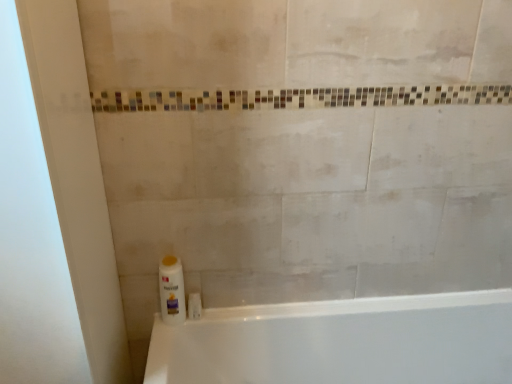
Question: From the image's perspective, would you say white glossy bathtub at lower left is shown under white glossy screen door at left?

Choices:
 (A) no
 (B) yes

Answer: (B)

Question: Considering the relative sizes of white glossy bathtub at lower left and white glossy screen door at left in the image provided, is white glossy bathtub at lower left taller than white glossy screen door at left?

Choices:
 (A) no
 (B) yes

Answer: (A)

Question: Is white glossy bathtub at lower left in contact with white glossy screen door at left?

Choices:
 (A) no
 (B) yes

Answer: (A)

Question: Can you confirm if white glossy bathtub at lower left is smaller than white glossy screen door at left?

Choices:
 (A) no
 (B) yes

Answer: (A)

Question: From a real-world perspective, does white glossy bathtub at lower left stand above white glossy screen door at left?

Choices:
 (A) no
 (B) yes

Answer: (A)

Question: Considering the relative positions of white glossy screen door at left and white glossy bathtub at lower left in the image provided, is white glossy screen door at left to the left or to the right of white glossy bathtub at lower left?

Choices:
 (A) right
 (B) left

Answer: (B)

Question: From the image's perspective, relative to white glossy bathtub at lower left, is white glossy screen door at left above or below?

Choices:
 (A) above
 (B) below

Answer: (A)

Question: Based on their sizes in the image, would you say white glossy screen door at left is bigger or smaller than white glossy bathtub at lower left?

Choices:
 (A) small
 (B) big

Answer: (A)

Question: Considering their positions, is white glossy screen door at left located in front of or behind white glossy bathtub at lower left?

Choices:
 (A) behind
 (B) front

Answer: (B)

Question: Based on their positions, is white glossy bottle at lower left located to the left or right of white glossy screen door at left?

Choices:
 (A) left
 (B) right

Answer: (B)

Question: Do you think white glossy bottle at lower left is within white glossy screen door at left, or outside of it?

Choices:
 (A) outside
 (B) inside

Answer: (A)

Question: Considering the positions of white glossy bottle at lower left and white glossy screen door at left in the image, is white glossy bottle at lower left wider or thinner than white glossy screen door at left?

Choices:
 (A) wide
 (B) thin

Answer: (B)

Question: From the image's perspective, is white glossy bottle at lower left located above or below white glossy screen door at left?

Choices:
 (A) below
 (B) above

Answer: (A)

Question: Based on their sizes in the image, would you say white glossy bathtub at lower left is bigger or smaller than white glossy screen door at left?

Choices:
 (A) small
 (B) big

Answer: (B)

Question: Considering the relative positions of white glossy bathtub at lower left and white glossy screen door at left in the image provided, is white glossy bathtub at lower left to the left or to the right of white glossy screen door at left?

Choices:
 (A) right
 (B) left

Answer: (A)